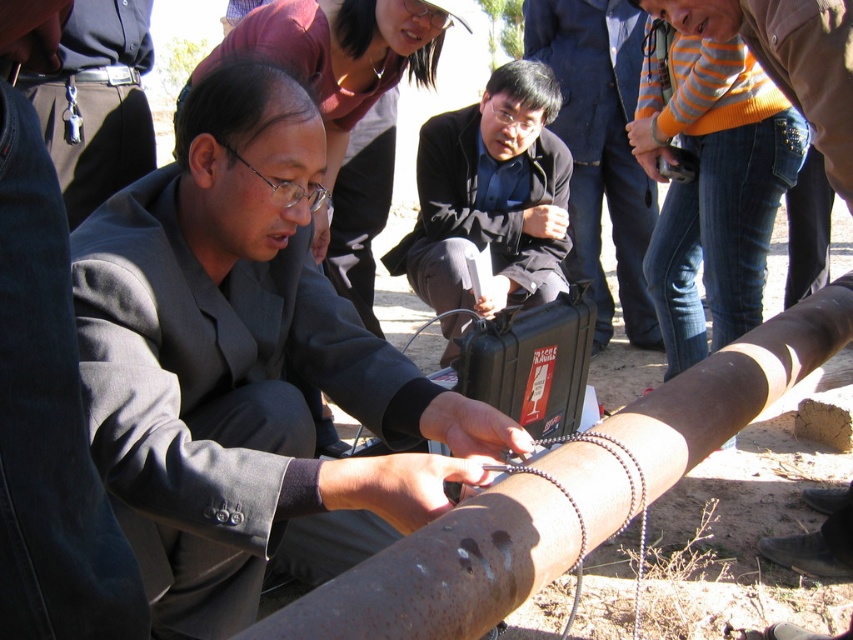
You are standing in the open area and want to approach the matte gray suit at center to hand over a document. How many steps do you need to take if each step covers 2.5 feet?

The matte gray suit at center is 35.55 inches away from viewer. Since each step covers 2.5 feet, which is 30 inches, you would need to take 1 step to reach the matte gray suit at center because 35.55 inches is less than 30 inches multiplied by 2 steps.

You are a technician who needs to transport both the rusty metal pipe at center and the black matte briefcase at center in the back of a truck. The truck bed has a width restriction of 30 cm. Can both items be placed side by side without exceeding the width limit?

The rusty metal pipe at center is wider than the black matte briefcase at center. Since the truck bed has a width restriction of 30 cm, we need to know the combined width of both items. However, without specific measurements for each item, it is impossible to determine if they can fit side by side within the 30 cm limit. Additional information about their individual widths is required to make this assessment.

You are a photographer positioned to the side of the scene. You need to capture a clear photo of both the matte gray suit at center and the black matte briefcase at center. Which object should you focus on first if you want to ensure both are in focus without adjusting the camera settings?

The matte gray suit at center is thinner than the black matte briefcase at center, so you should focus on the black matte briefcase at center first. This ensures that the larger object is in focus, and the thinner matte gray suit at center will also be within the depth of field.